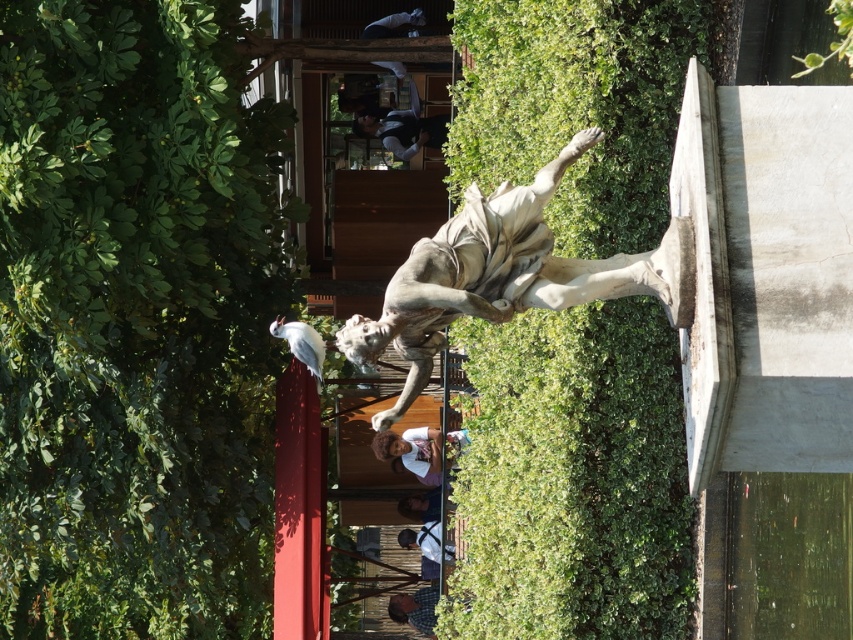
You are an art student standing in front of the white marble statue at center and the smooth brown hair at center. Which object is closer to you?

The white marble statue at center is closer to you because it is in front of the smooth brown hair at center.

You are an artist trying to sketch the scene. You need to decide which object to draw first based on their widths. Which one should you start with, the white marble statue at center or the smooth brown hair at center?

The white marble statue at center might be wider than smooth brown hair at center, so you should start with the white marble statue at center to capture its broader form first.

You are an artist setting up an easel to paint the statue. You have two items in view, the green leafy hedge at upper left and the white matte shirt at center. Which object should you focus on if you want to paint the larger one?

The green leafy hedge at upper left is bigger than the white matte shirt at center, so you should focus on the green leafy hedge at upper left to paint the larger one.